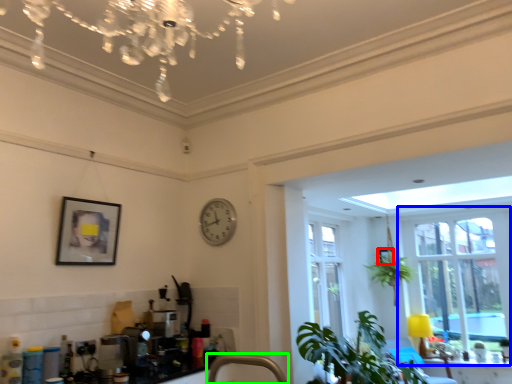
Question: Based on their relative distances, which object is nearer to picture frame (highlighted by a red box)? Choose from window (highlighted by a blue box) and faucet (highlighted by a green box).

Choices:
 (A) window
 (B) faucet

Answer: (A)